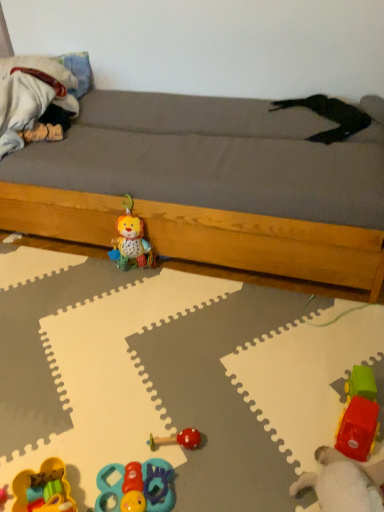
Locate an element on the screen. This screenshot has width=384, height=512. vacant area that lies between plush fabric lion at center, arranged as the 5th toy when viewed from the right, and rubberized plastic truck at lower right, marked as the 1th toy in a right-to-left arrangement is located at coordinates (233, 334).